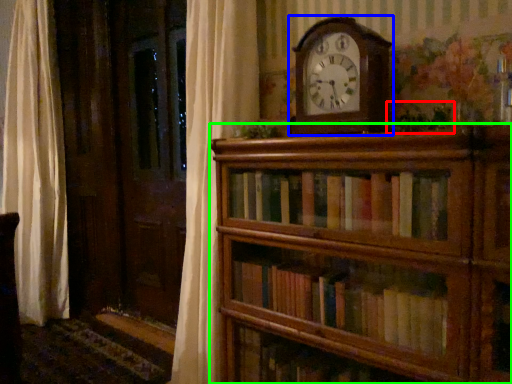
Question: Which object is the farthest from plant (highlighted by a red box)? Choose among these: wall clock (highlighted by a blue box) or shelf (highlighted by a green box).

Choices:
 (A) wall clock
 (B) shelf

Answer: (B)